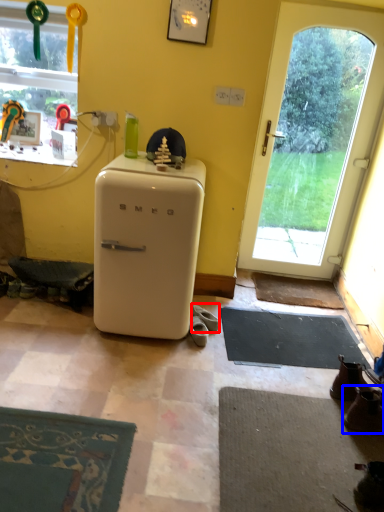
Question: Which object is further to the camera taking this photo, footwear (highlighted by a red box) or footwear (highlighted by a blue box)?

Choices:
 (A) footwear
 (B) footwear

Answer: (A)